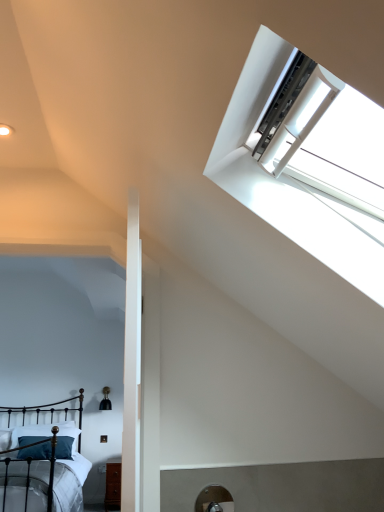
Question: Can you confirm if black wrought iron bed at lower left is bigger than white plastic window at upper right?

Choices:
 (A) yes
 (B) no

Answer: (A)

Question: Does black wrought iron bed at lower left contain white plastic window at upper right?

Choices:
 (A) no
 (B) yes

Answer: (A)

Question: From the image's perspective, would you say black wrought iron bed at lower left is shown under white plastic window at upper right?

Choices:
 (A) no
 (B) yes

Answer: (B)

Question: Does black wrought iron bed at lower left appear on the right side of white plastic window at upper right?

Choices:
 (A) yes
 (B) no

Answer: (B)

Question: From the image's perspective, is black wrought iron bed at lower left over white plastic window at upper right?

Choices:
 (A) yes
 (B) no

Answer: (B)

Question: Is white plastic window at upper right taller or shorter than dark blue fabric pillow at lower left?

Choices:
 (A) tall
 (B) short

Answer: (A)

Question: From a real-world perspective, is white plastic window at upper right physically located above or below dark blue fabric pillow at lower left?

Choices:
 (A) below
 (B) above

Answer: (B)

Question: Is white plastic window at upper right in front of or behind dark blue fabric pillow at lower left in the image?

Choices:
 (A) front
 (B) behind

Answer: (A)

Question: From the image's perspective, is white plastic window at upper right positioned above or below dark blue fabric pillow at lower left?

Choices:
 (A) below
 (B) above

Answer: (B)

Question: Considering the positions of black wrought iron bed at lower left and dark blue fabric pillow at lower left in the image, is black wrought iron bed at lower left bigger or smaller than dark blue fabric pillow at lower left?

Choices:
 (A) small
 (B) big

Answer: (B)

Question: Visually, is black wrought iron bed at lower left positioned to the left or to the right of dark blue fabric pillow at lower left?

Choices:
 (A) left
 (B) right

Answer: (A)

Question: From the image's perspective, relative to dark blue fabric pillow at lower left, is black wrought iron bed at lower left above or below?

Choices:
 (A) above
 (B) below

Answer: (A)

Question: From their relative heights in the image, would you say black wrought iron bed at lower left is taller or shorter than dark blue fabric pillow at lower left?

Choices:
 (A) tall
 (B) short

Answer: (A)

Question: Considering the positions of dark blue fabric pillow at lower left and white plastic window at upper right in the image, is dark blue fabric pillow at lower left wider or thinner than white plastic window at upper right?

Choices:
 (A) thin
 (B) wide

Answer: (A)

Question: Considering the positions of dark blue fabric pillow at lower left and white plastic window at upper right in the image, is dark blue fabric pillow at lower left taller or shorter than white plastic window at upper right?

Choices:
 (A) short
 (B) tall

Answer: (A)